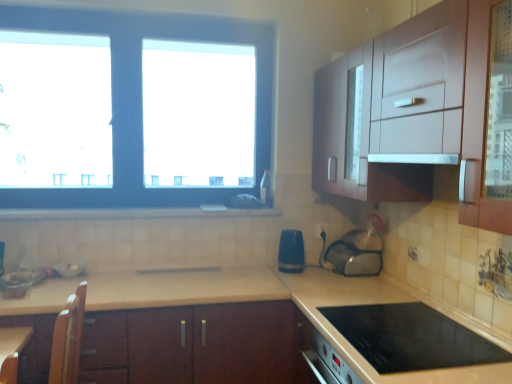
You are a GUI agent. You are given a task and a screenshot of the screen. Output one action in this format:
    pyautogui.click(x=<x>, y=<y>)
    Task: Click on the vacant location below blue plastic toaster at center, marked as the second appliance in a left-to-right arrangement (from a real-world perspective)
    
    Given the screenshot: What is the action you would take?
    pyautogui.click(x=292, y=270)